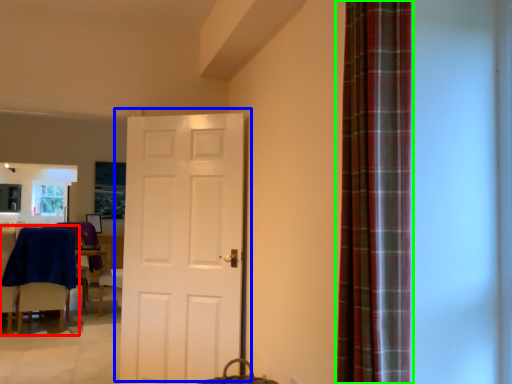
Question: Estimate the real-world distances between objects in this image. Which object is farther from chair (highlighted by a red box), door (highlighted by a blue box) or curtain (highlighted by a green box)?

Choices:
 (A) door
 (B) curtain

Answer: (B)